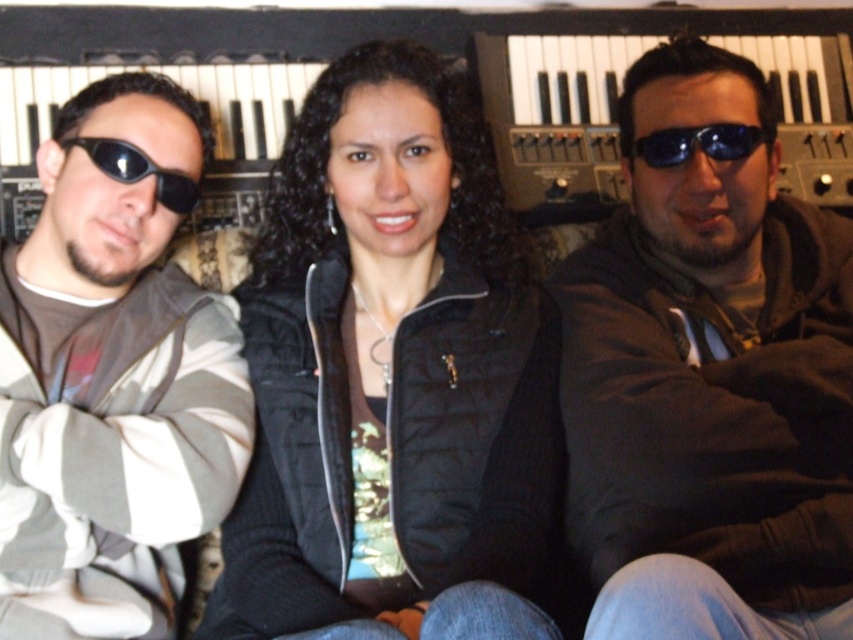
Is black plastic sunglasses at center bigger than black matte sunglasses at left?

No.

Is point (692, 134) in front of point (102, 140)?

No, (692, 134) is further to viewer.

The width and height of the screenshot is (853, 640). Describe the element at coordinates (695, 144) in the screenshot. I see `black plastic sunglasses at center` at that location.

Where is `black plastic sunglasses at center`? The image size is (853, 640). black plastic sunglasses at center is located at coordinates (695, 144).

Is dark brown hoodie at center to the left of striped fabric jacket at left from the viewer's perspective?

No, dark brown hoodie at center is not to the left of striped fabric jacket at left.

Which is more to the left, dark brown hoodie at center or striped fabric jacket at left?

striped fabric jacket at left

Does point (573, 365) come farther from viewer compared to point (171, 186)?

Yes, it is.

Locate an element on the screen. The height and width of the screenshot is (640, 853). dark brown hoodie at center is located at coordinates (709, 381).

Between dark brown hoodie at center and black plastic keyboard at center, which one is positioned higher?

black plastic keyboard at center is higher up.

Is dark brown hoodie at center thinner than black plastic keyboard at center?

Correct, dark brown hoodie at center's width is less than black plastic keyboard at center's.

Locate an element on the screen. This screenshot has height=640, width=853. dark brown hoodie at center is located at coordinates (709, 381).

Where is `dark brown hoodie at center`? The image size is (853, 640). dark brown hoodie at center is located at coordinates (709, 381).